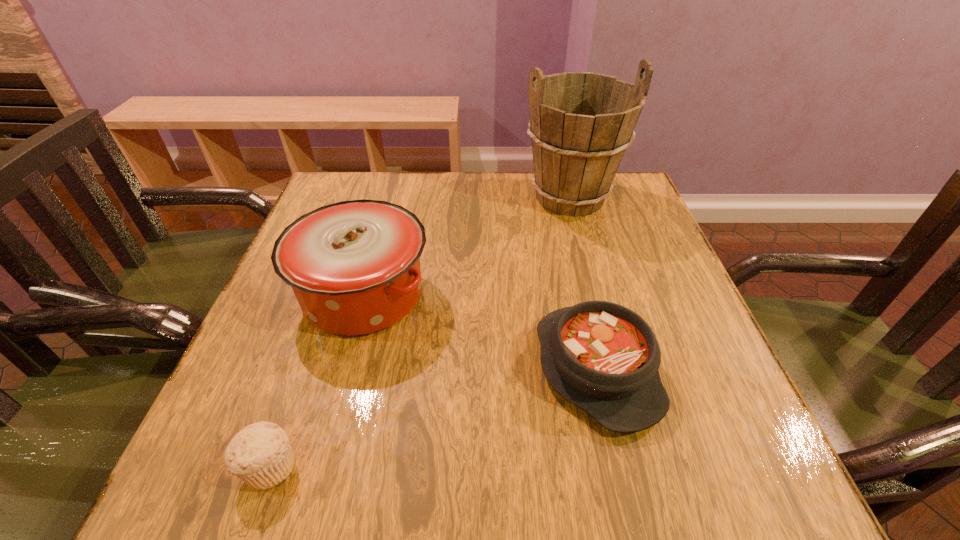
This screenshot has height=540, width=960. I want to click on vacant space that satisfies the following two spatial constraints: 1. on the back side of the muffin; 2. on the right side of the shorter casserole, so click(x=303, y=369).

Where is `vacant space that satisfies the following two spatial constraints: 1. on the back side of the muffin; 2. on the left side of the shorter casserole`? Image resolution: width=960 pixels, height=540 pixels. vacant space that satisfies the following two spatial constraints: 1. on the back side of the muffin; 2. on the left side of the shorter casserole is located at coordinates coord(303,369).

Where is `free space that satisfies the following two spatial constraints: 1. on the back side of the muffin; 2. on the right side of the left casserole`? This screenshot has height=540, width=960. free space that satisfies the following two spatial constraints: 1. on the back side of the muffin; 2. on the right side of the left casserole is located at coordinates (329, 294).